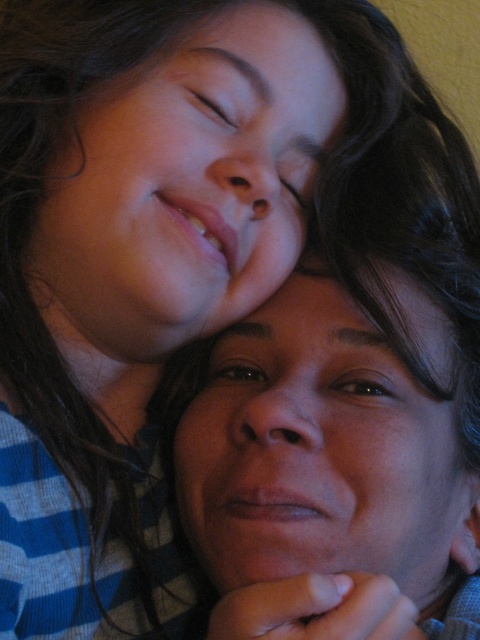
You are a photographer adjusting the lighting for a portrait. You notice two smooth skin faces in the frame. The first is labeled as smooth skin face at upper center, and the second as smooth skin face at center. Which face should you adjust the lighting for to ensure even illumination if the left side of the image is darker?

The smooth skin face at upper center is to the left of the smooth skin face at center. Since the left side of the image is darker, you should adjust the lighting for the smooth skin face at upper center to ensure it receives adequate illumination.

You are a photographer adjusting the focus on your camera. You want to capture both faces clearly. Since the smooth skin face at upper center and the smooth skin face at center are at different distances, which face should you focus on to ensure both are sharp?

To ensure both the smooth skin face at upper center and the smooth skin face at center are sharp, focus on the smooth skin face at upper center because it is closer to the camera, allowing the smooth skin face at center behind it to remain in focus as well.